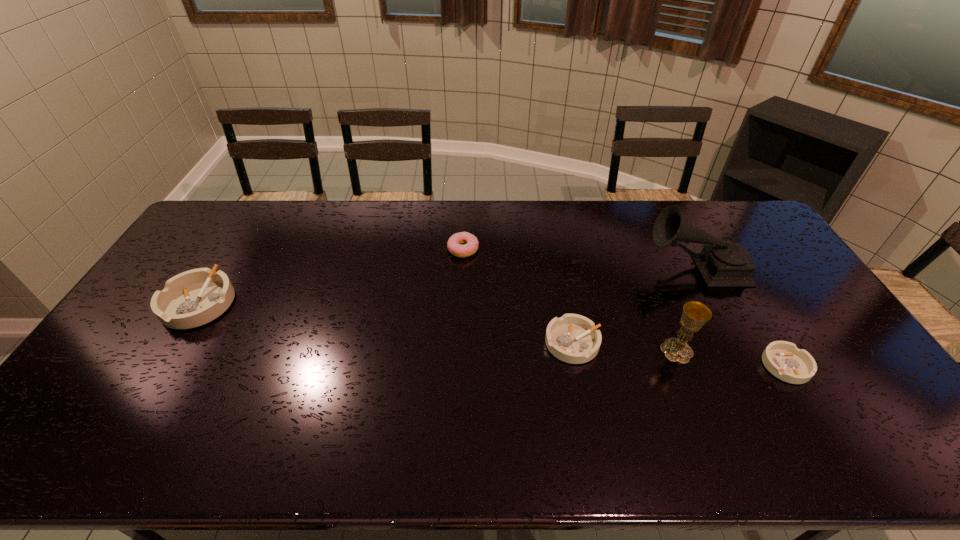
Locate an element on the screen. The image size is (960, 540). vacant space situated on the front of the second tallest ashtray is located at coordinates (587, 413).

You are a GUI agent. You are given a task and a screenshot of the screen. Output one action in this format:
    pyautogui.click(x=<x>, y=<y>)
    Task: Click on the vacant point located on the back of the shortest object
    The image size is (960, 540).
    Given the screenshot: What is the action you would take?
    pyautogui.click(x=737, y=284)

At what (x,y) coordinates should I click in order to perform the action: click on vacant space located on the right of the second tallest object. Please return your answer as a coordinate pair (x, y). The height and width of the screenshot is (540, 960). Looking at the image, I should click on (816, 350).

Identify the location of vacant space situated from the horn of the phonograph_record. The image size is (960, 540). (551, 267).

Locate an element on the screen. The width and height of the screenshot is (960, 540). vacant space located 0.200m from the horn of the phonograph_record is located at coordinates (585, 267).

Find the location of a particular element. free space located from the horn of the phonograph_record is located at coordinates (554, 267).

Locate an element on the screen. blank area located on the right of the second object from left to right is located at coordinates (574, 249).

Locate an element on the screen. object located in the left edge section of the desktop is located at coordinates (193, 298).

At what (x,y) coordinates should I click in order to perform the action: click on ashtray that is at the right edge. Please return your answer as a coordinate pair (x, y). Looking at the image, I should click on (783, 359).

Find the location of a particular element. Image resolution: width=960 pixels, height=540 pixels. phonograph_record that is at the right edge is located at coordinates (722, 263).